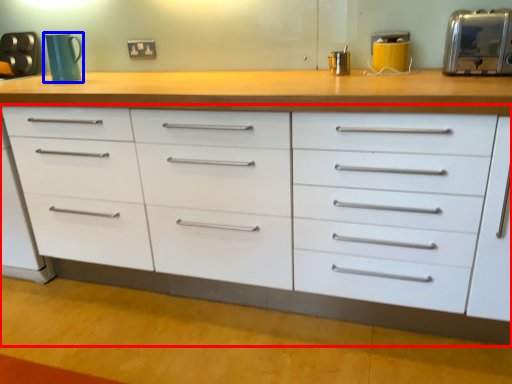
Question: Which object is further to the camera taking this photo, chest of drawers (highlighted by a red box) or mug (highlighted by a blue box)?

Choices:
 (A) chest of drawers
 (B) mug

Answer: (B)